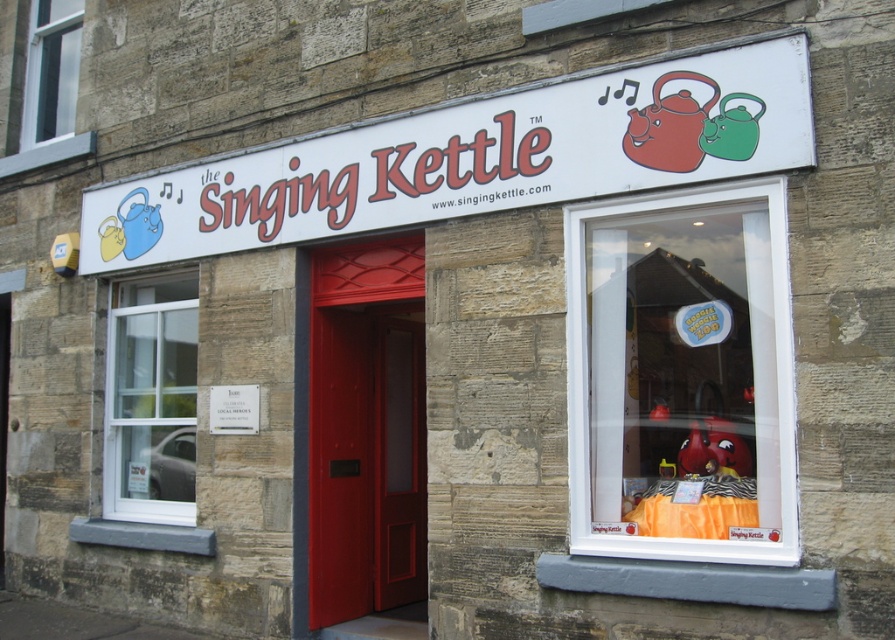
You are a window installer who needs to replace the white plastic sign at upper center and the white plastic window at upper left. Which one is shorter in height?

The white plastic sign at upper center has a lesser height compared to the white plastic window at upper left, so the white plastic sign at upper center is shorter in height.